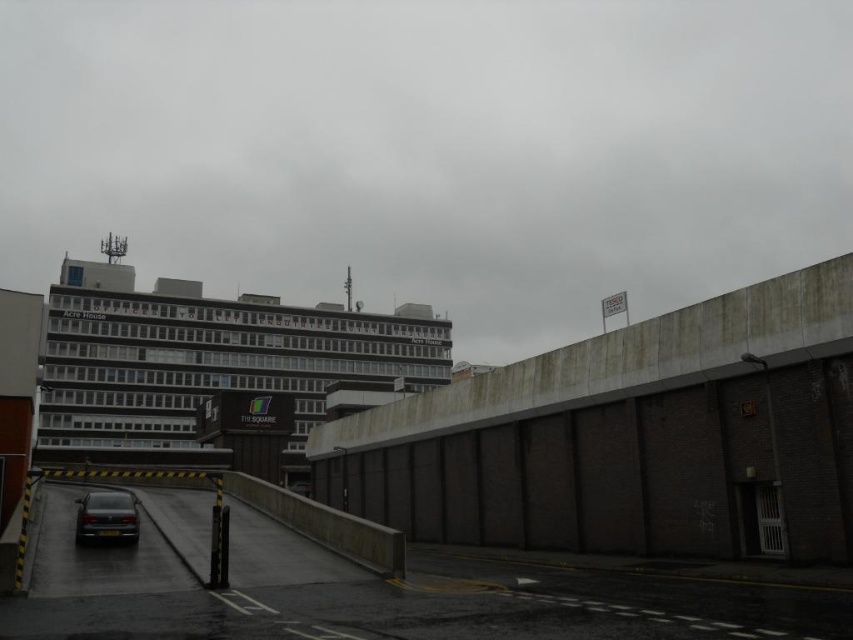
Does gray concrete building at upper center have a lesser width compared to concrete wall at center?

Incorrect, gray concrete building at upper center's width is not less than concrete wall at center's.

Measure the distance between point (160, 74) and camera.

Point (160, 74) and camera are 322.02 meters apart from each other.

Is point (534, 264) farther from viewer compared to point (480, 532)?

Yes, it is.

The height and width of the screenshot is (640, 853). What are the coordinates of `gray concrete building at upper center` in the screenshot? It's located at (431, 150).

Does point (810, 390) come in front of point (138, 518)?

Yes, point (810, 390) is closer to viewer.

Where is `concrete wall at center`? concrete wall at center is located at coordinates (627, 435).

Which of these two, concrete wall at center or dark gray concrete building at upper center, stands shorter?

concrete wall at center is shorter.

I want to click on concrete wall at center, so click(627, 435).